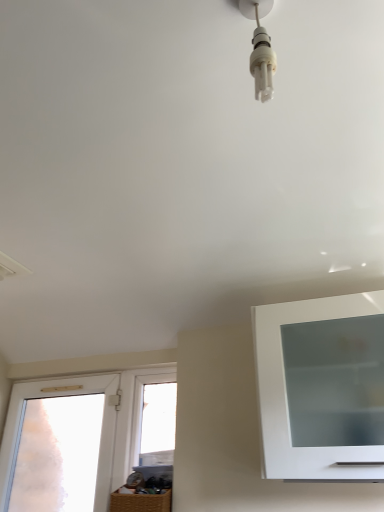
Question: Considering the positions of white plastic light bulb at upper center and transparent glass window at center, the 1th window in the right-to-left sequence, in the image, is white plastic light bulb at upper center wider or thinner than transparent glass window at center, the 1th window in the right-to-left sequence,?

Choices:
 (A) thin
 (B) wide

Answer: (B)

Question: Is white plastic light bulb at upper center inside the boundaries of transparent glass window at center, the 1th window in the right-to-left sequence, or outside?

Choices:
 (A) inside
 (B) outside

Answer: (B)

Question: Estimate the real-world distances between objects in this image. Which object is closer to the white plastic light bulb at upper center?

Choices:
 (A) transparent frosted glass door at left, the second window positioned from the right
 (B) transparent glass window at center, the 1th window in the right-to-left sequence

Answer: (B)

Question: Which object is positioned farthest from the white plastic light bulb at upper center?

Choices:
 (A) transparent frosted glass door at left, the first window in the left-to-right sequence
 (B) transparent glass window at center, the 1th window in the right-to-left sequence

Answer: (A)